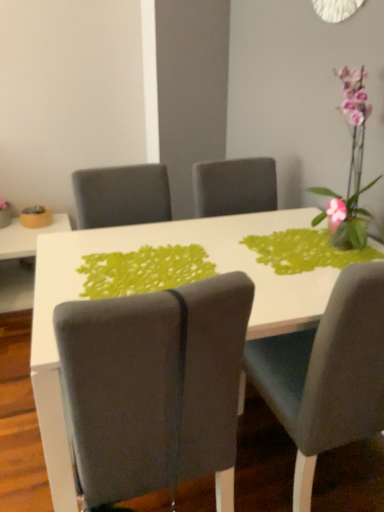
Question: Does green fabric placemat at center come in front of velvet gray chair at right, the 1th chair from the right?

Choices:
 (A) no
 (B) yes

Answer: (A)

Question: Is green fabric placemat at center positioned far away from velvet gray chair at right, positioned as the second chair in left-to-right order?

Choices:
 (A) yes
 (B) no

Answer: (B)

Question: Are green fabric placemat at center and velvet gray chair at right, the 1th chair from the right, making contact?

Choices:
 (A) yes
 (B) no

Answer: (B)

Question: Considering the relative sizes of green fabric placemat at center and velvet gray chair at right, positioned as the second chair in left-to-right order, in the image provided, is green fabric placemat at center wider than velvet gray chair at right, positioned as the second chair in left-to-right order,?

Choices:
 (A) no
 (B) yes

Answer: (A)

Question: From a real-world perspective, is green fabric placemat at center beneath velvet gray chair at right, the 1th chair from the right?

Choices:
 (A) yes
 (B) no

Answer: (B)

Question: Is green fabric placemat at center oriented away from velvet gray chair at right, the 1th chair from the right?

Choices:
 (A) no
 (B) yes

Answer: (B)

Question: Is white glossy table at center, which is the 1th table in front-to-back order, looking in the opposite direction of velvet gray chair at right, the 1th chair from the right?

Choices:
 (A) no
 (B) yes

Answer: (B)

Question: Can you see white glossy table at center, which is the 1th table in front-to-back order, touching velvet gray chair at right, positioned as the second chair in left-to-right order?

Choices:
 (A) no
 (B) yes

Answer: (A)

Question: From a real-world perspective, is white glossy table at center, the 2th table when ordered from left to right, over velvet gray chair at right, positioned as the second chair in left-to-right order?

Choices:
 (A) no
 (B) yes

Answer: (A)

Question: Is white glossy table at center, which is the 1th table in front-to-back order, closer to camera compared to velvet gray chair at right, the 1th chair from the right?

Choices:
 (A) no
 (B) yes

Answer: (A)

Question: Can you confirm if white glossy table at center, which ranks as the first table in right-to-left order, is thinner than velvet gray chair at right, positioned as the second chair in left-to-right order?

Choices:
 (A) no
 (B) yes

Answer: (A)

Question: Is white glossy table at center, the second table from the back, at the right side of velvet gray chair at right, positioned as the second chair in left-to-right order?

Choices:
 (A) no
 (B) yes

Answer: (A)

Question: Can you confirm if suede gray chair at center, which appears as the 1th chair when viewed from the left, is bigger than green fabric placemat at center?

Choices:
 (A) no
 (B) yes

Answer: (B)